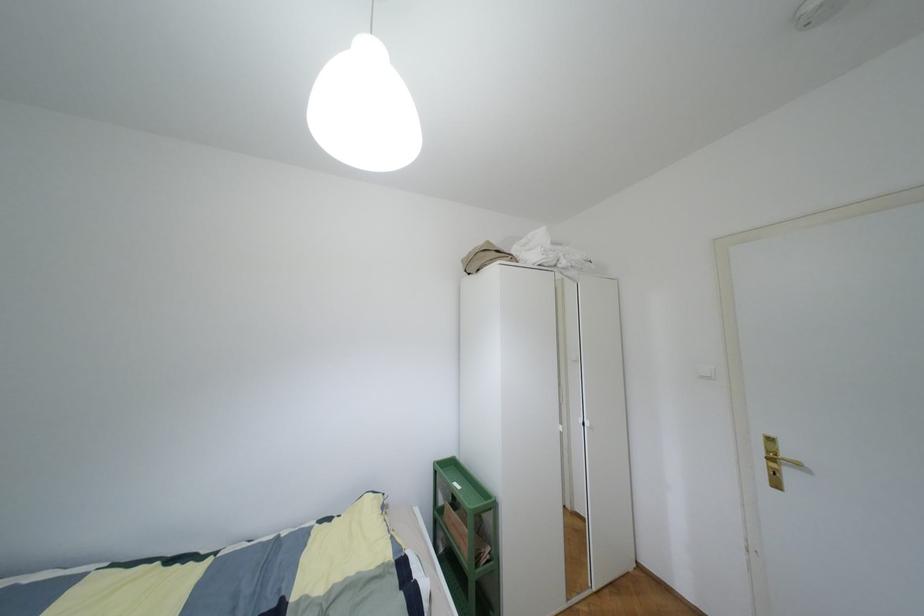
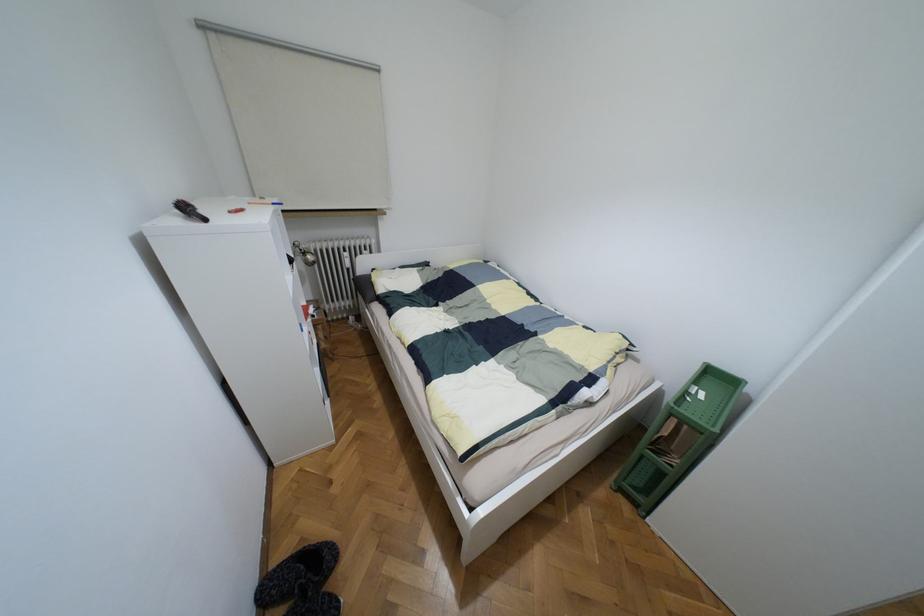
First-person continuous shooting, in which direction is the camera rotating?

The camera rotated toward left-down.